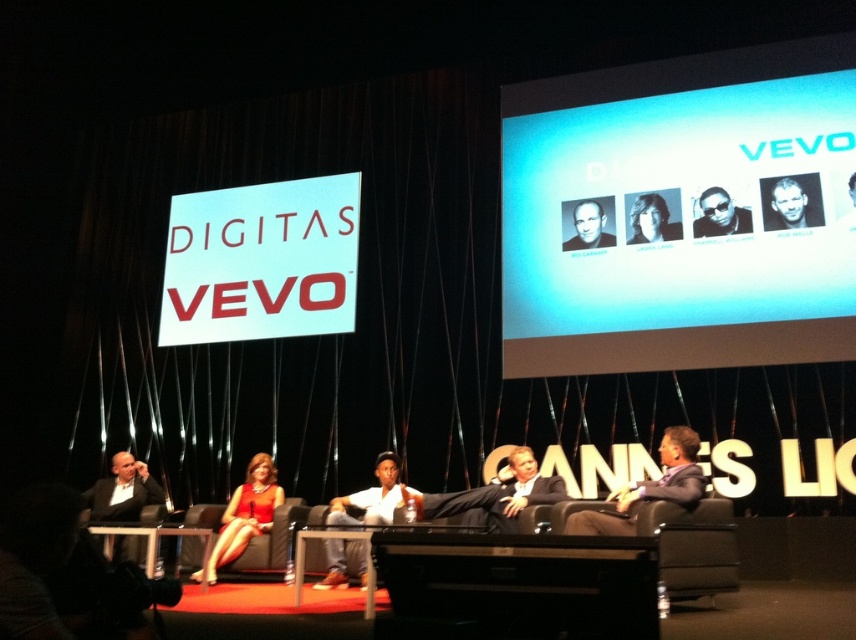
Which of these two, dark gray suit at left or smooth skin face at upper right, stands shorter?

Standing shorter between the two is smooth skin face at upper right.

Does point (88, 506) lie behind point (815, 209)?

Yes.

Locate an element on the screen. This screenshot has width=856, height=640. dark gray suit at left is located at coordinates (122, 492).

Does gray suit at center have a greater height compared to smooth skin face at center?

Result: Indeed, gray suit at center has a greater height compared to smooth skin face at center.

In the scene shown: Which is more to the right, gray suit at center or smooth skin face at center?

From the viewer's perspective, smooth skin face at center appears more on the right side.

Between point (634, 515) and point (583, 202), which one is positioned behind?

Positioned behind is point (583, 202).

Locate an element on the screen. gray suit at center is located at coordinates (648, 488).

Does blue glossy screen at upper center have a lesser height compared to dark gray suit at left?

No.

The width and height of the screenshot is (856, 640). Find the location of `blue glossy screen at upper center`. blue glossy screen at upper center is located at coordinates (681, 212).